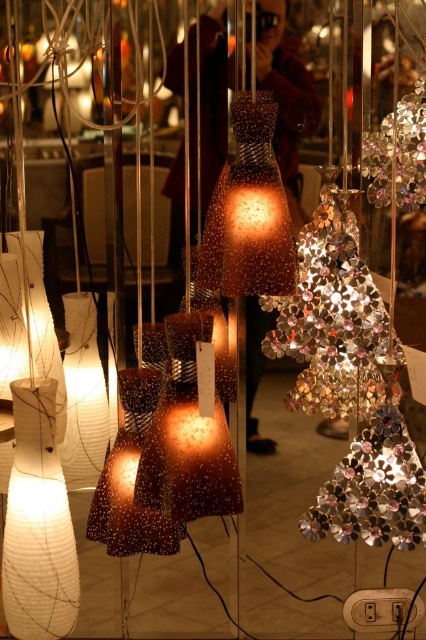
Question: Does shiny metallic ornament at center lie in front of shiny metallic garland at right?

Choices:
 (A) no
 (B) yes

Answer: (A)

Question: Is shiny metallic ornament at center smaller than shiny metallic garland at right?

Choices:
 (A) yes
 (B) no

Answer: (B)

Question: Which of the following is the farthest from the observer?

Choices:
 (A) shiny metallic ornament at center
 (B) shiny metallic garland at right

Answer: (A)

Question: Which point is closer to the camera taking this photo?

Choices:
 (A) (339, 225)
 (B) (402, 106)

Answer: (A)

Question: Does shiny metallic ornament at center appear on the left side of shiny metallic garland at right?

Choices:
 (A) yes
 (B) no

Answer: (A)

Question: Among these points, which one is nearest to the camera?

Choices:
 (A) (314, 227)
 (B) (362, 170)

Answer: (A)